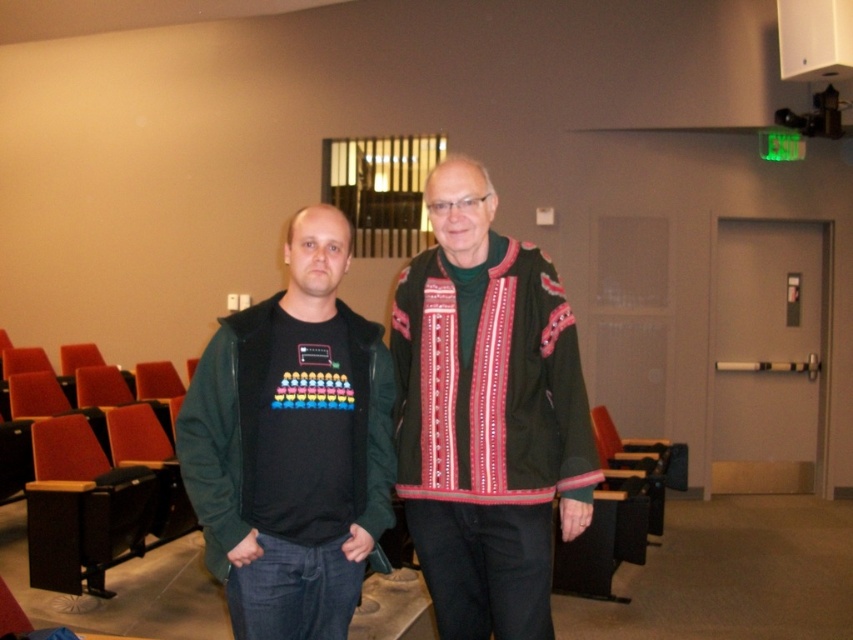
You are a photographer setting up for a group photo in the lecture hall. You notice two people wearing dark green clothing at the center of the frame. Which of the two, the dark green textured jacket at center or the dark green woolen sweater at center, should you adjust to ensure both are in focus? Explain your reasoning based on their positions.

The dark green textured jacket at center is closer to the viewer than the dark green woolen sweater at center. To ensure both are in focus, adjust the camera to focus on the closer jacket, as the depth of field may not cover both distances simultaneously. Alternatively, use a smaller aperture for greater depth of field.

You are a photographer setting up a shoot in the lecture hall. You need to ensure that both the dark green textured jacket at center and the green fleece vest at center are fully visible in the frame. Given their height difference, which of the two requires you to adjust your camera angle to avoid being cropped out?

The dark green textured jacket at center is much taller than the green fleece vest at center, so you need to adjust the camera angle to ensure the taller jacket is fully visible without being cropped out.

You are standing in the lecture hall and want to reach the exit door. There is a point at coordinates point (566, 413) that is 7.11 feet away from you. Can you walk straight towards the exit door without passing through this point?

The point at coordinates point (566, 413) is 7.11 feet away from you. Since the exit door is located above the door with the exit sign, you can walk straight towards it without passing through the point as long as your path is clear.